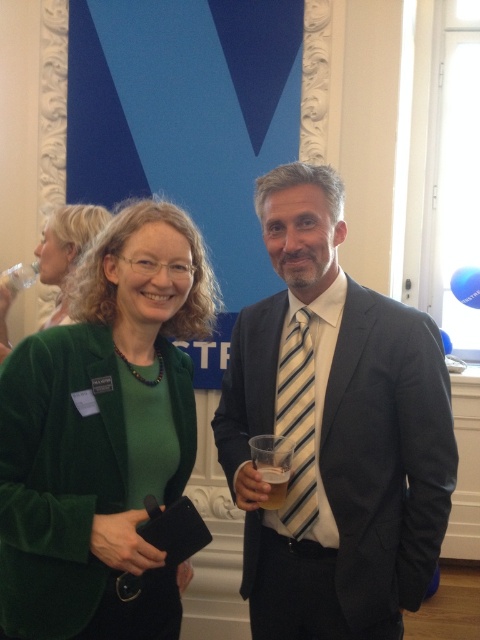
In the scene shown: You are an event planner organizing a photoshoot and need to arrange two green velvet garments for a display. The velvet green blazer at center and the green velvet jacket at lower left are available. Which garment should you choose if you want the taller one for the main display?

The velvet green blazer at center is taller than the green velvet jacket at lower left, so you should choose the velvet green blazer at center for the main display.